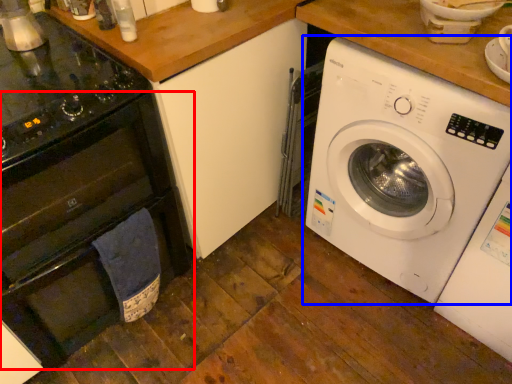
Question: Which object appears closest to the camera in this image, oven (highlighted by a red box) or washing machine (highlighted by a blue box)?

Choices:
 (A) oven
 (B) washing machine

Answer: (A)